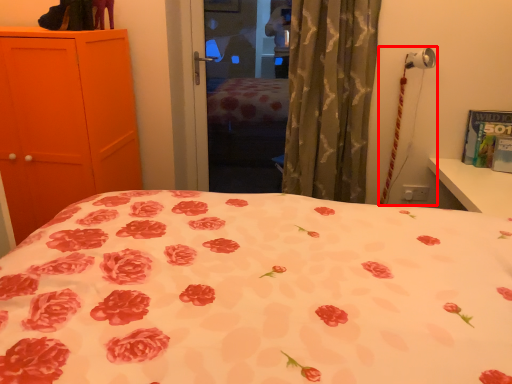
Question: In this image, where is table lamp (annotated by the red box) located relative to curtain?

Choices:
 (A) left
 (B) right

Answer: (B)